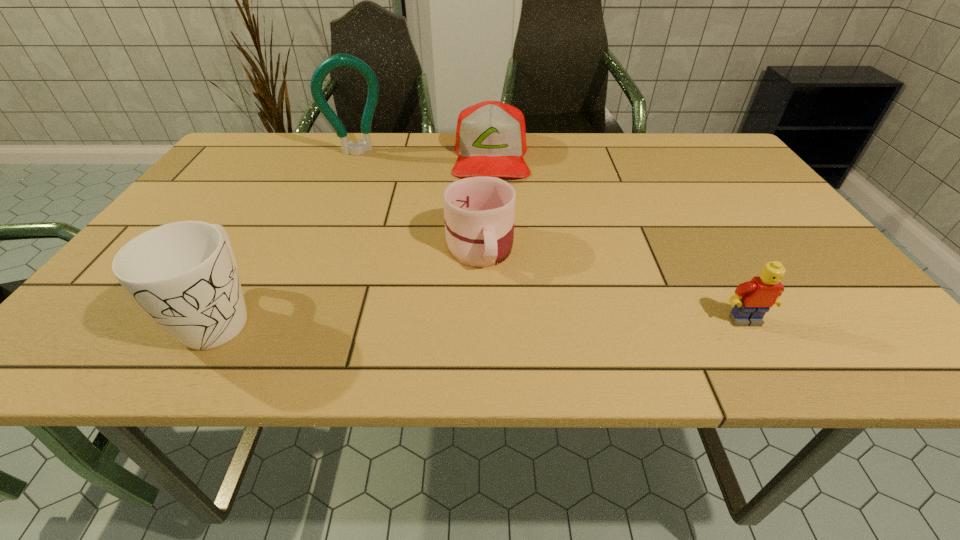
Find the location of a particular element. the taller mug is located at coordinates (184, 275).

I want to click on the fourth shortest object, so click(184, 275).

This screenshot has height=540, width=960. I want to click on Lego, so click(x=752, y=299).

Image resolution: width=960 pixels, height=540 pixels. In order to click on the right mug in this screenshot , I will do `click(479, 212)`.

Where is `baseball cap`? This screenshot has width=960, height=540. baseball cap is located at coordinates coord(491,136).

You are a GUI agent. You are given a task and a screenshot of the screen. Output one action in this format:
    pyautogui.click(x=<x>, y=<y>)
    Task: Click on the tallest object
    
    Given the screenshot: What is the action you would take?
    pyautogui.click(x=339, y=60)

You are a GUI agent. You are given a task and a screenshot of the screen. Output one action in this format:
    pyautogui.click(x=<x>, y=<y>)
    Task: Click on the free spot located 0.060m on the side with the handle of the right mug
    
    Given the screenshot: What is the action you would take?
    pyautogui.click(x=488, y=298)

Identify the location of vacant space located 0.110m on the side with the handle of the right mug. The image size is (960, 540). (491, 318).

Identify the location of blank space located on the front-facing side of the baseball cap. (493, 271).

At what (x,y) coordinates should I click in order to perform the action: click on free region located on the front-facing side of the baseball cap. Please return your answer as a coordinate pair (x, y). Looking at the image, I should click on (492, 218).